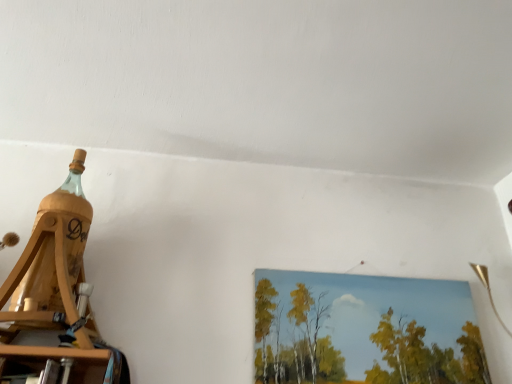
Question: Is the surface of wooden picture frame at upper right in direct contact with wooden bottle at left?

Choices:
 (A) no
 (B) yes

Answer: (A)

Question: Does wooden picture frame at upper right come in front of wooden bottle at left?

Choices:
 (A) yes
 (B) no

Answer: (B)

Question: Does wooden picture frame at upper right have a lesser height compared to wooden bottle at left?

Choices:
 (A) no
 (B) yes

Answer: (B)

Question: Can you confirm if wooden picture frame at upper right is smaller than wooden bottle at left?

Choices:
 (A) yes
 (B) no

Answer: (A)

Question: Is there a large distance between wooden picture frame at upper right and wooden bottle at left?

Choices:
 (A) no
 (B) yes

Answer: (A)

Question: Is wooden picture frame at upper right aimed at wooden bottle at left?

Choices:
 (A) yes
 (B) no

Answer: (B)

Question: Is wooden bottle at left outside wooden picture frame at upper right?

Choices:
 (A) yes
 (B) no

Answer: (A)

Question: Is wooden bottle at left oriented away from wooden picture frame at upper right?

Choices:
 (A) yes
 (B) no

Answer: (B)

Question: From the image's perspective, is wooden bottle at left on wooden picture frame at upper right?

Choices:
 (A) yes
 (B) no

Answer: (A)

Question: From the image's perspective, is wooden bottle at left under wooden picture frame at upper right?

Choices:
 (A) yes
 (B) no

Answer: (B)

Question: Is wooden bottle at left shorter than wooden picture frame at upper right?

Choices:
 (A) yes
 (B) no

Answer: (B)

Question: Does wooden bottle at left have a smaller size compared to wooden picture frame at upper right?

Choices:
 (A) yes
 (B) no

Answer: (B)

Question: Is wooden picture frame at upper right taller or shorter than wooden bottle at left?

Choices:
 (A) tall
 (B) short

Answer: (B)